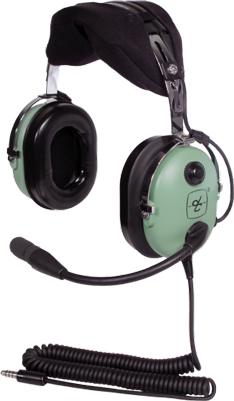
You are a GUI agent. You are given a task and a screenshot of the screen. Output one action in this format:
    pyautogui.click(x=<x>, y=<y>)
    Task: Click on the power cable
    The image size is (234, 401).
    Given the screenshot: What is the action you would take?
    pyautogui.click(x=193, y=354)